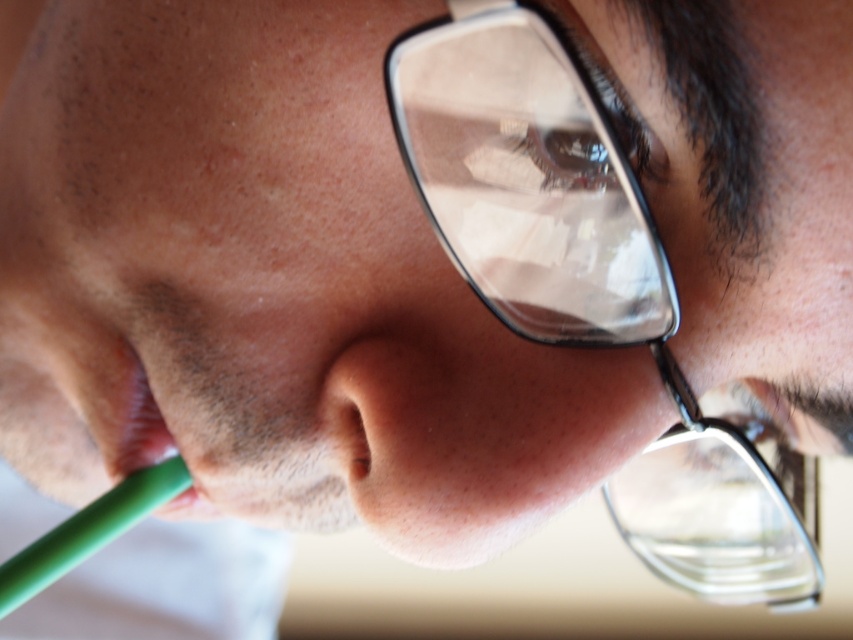
Which is behind, point (74, 561) or point (194, 497)?

Positioned behind is point (194, 497).

Does point (20, 570) come behind point (126, 381)?

Yes, it is behind point (126, 381).

Describe the element at coordinates (88, 531) in the screenshot. This screenshot has height=640, width=853. I see `green plastic straw at lower left` at that location.

The width and height of the screenshot is (853, 640). I want to click on green plastic straw at lower left, so tap(88, 531).